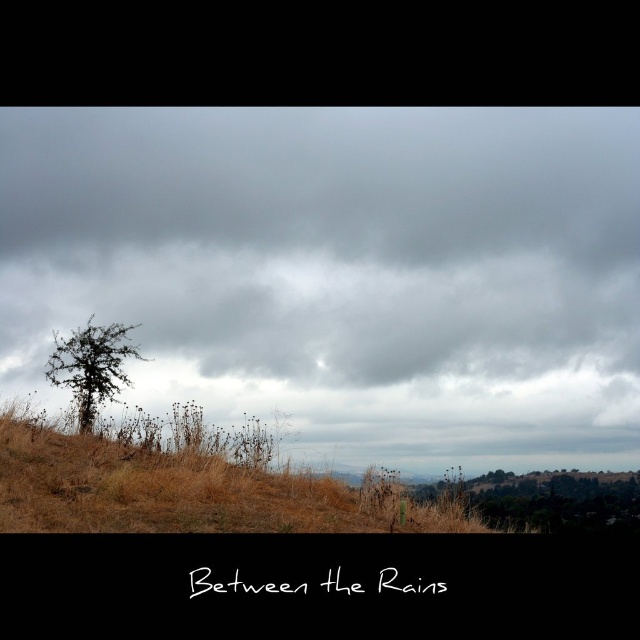
What do you see at coordinates (179, 492) in the screenshot?
I see `brown grassy hillside at lower center` at bounding box center [179, 492].

Locate an element on the screen. This screenshot has width=640, height=640. brown grassy hillside at lower center is located at coordinates (179, 492).

Between gray cloudy sky at upper center and brown grassy hillside at lower center, which one is positioned lower?

brown grassy hillside at lower center

Is point (461, 384) in front of point (163, 493)?

No, it is behind (163, 493).

Where is `gray cloudy sky at upper center`? This screenshot has width=640, height=640. gray cloudy sky at upper center is located at coordinates (342, 272).

Can you confirm if brown grassy hillside at lower center is smaller than brown grassy tree at lower right?

Yes, brown grassy hillside at lower center is smaller than brown grassy tree at lower right.

Does brown grassy hillside at lower center appear on the right side of brown grassy tree at lower right?

In fact, brown grassy hillside at lower center is to the left of brown grassy tree at lower right.

Identify the location of brown grassy hillside at lower center. This screenshot has width=640, height=640. (179, 492).

You are a GUI agent. You are given a task and a screenshot of the screen. Output one action in this format:
    pyautogui.click(x=<x>, y=<y>)
    Task: Click on the brown grassy hillside at lower center
    Image resolution: width=640 pixels, height=640 pixels.
    Given the screenshot: What is the action you would take?
    pyautogui.click(x=179, y=492)